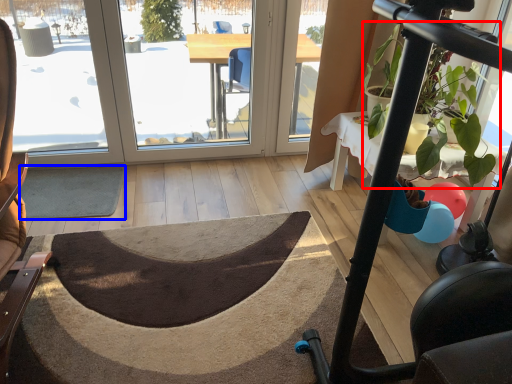
Question: Which of the following is the closest to the observer, plant (highlighted by a red box) or doormat (highlighted by a blue box)?

Choices:
 (A) plant
 (B) doormat

Answer: (A)